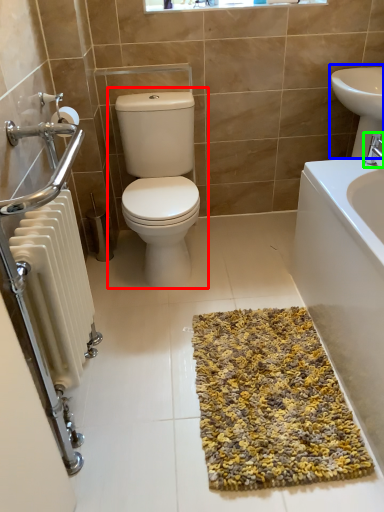
Question: Which is nearer to the toilet (highlighted by a red box)? sink (highlighted by a blue box) or tap (highlighted by a green box).

Choices:
 (A) sink
 (B) tap

Answer: (A)